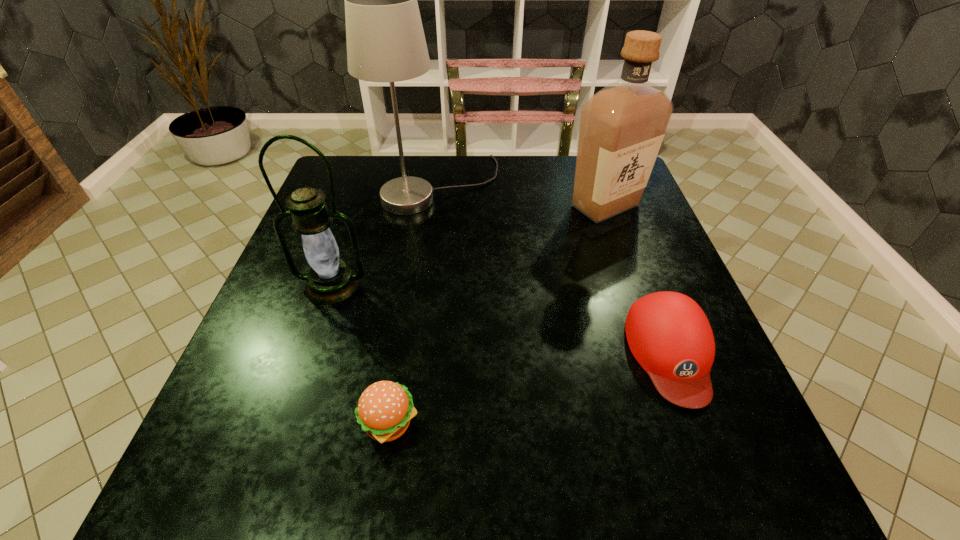
I want to click on vacant area between the table lamp and the baseball cap, so click(555, 269).

Find the location of a particular element. Image resolution: width=960 pixels, height=540 pixels. vacant point located between the liquor and the baseball cap is located at coordinates (637, 279).

Locate an element on the screen. vacant area that lies between the baseball cap and the hamburger is located at coordinates (530, 389).

Where is `empty space that is in between the liquor and the table lamp`? This screenshot has height=540, width=960. empty space that is in between the liquor and the table lamp is located at coordinates (522, 195).

Locate an element on the screen. Image resolution: width=960 pixels, height=540 pixels. vacant area between the third tallest object and the table lamp is located at coordinates (386, 235).

Image resolution: width=960 pixels, height=540 pixels. In order to click on vacant region between the hamburger and the liquor in this screenshot , I will do `click(497, 315)`.

Locate an element on the screen. the third closest object to the table lamp is located at coordinates (669, 335).

Identify which object is the second nearest to the hamburger. Please provide its 2D coordinates. Your answer should be formatted as a tuple, i.e. [(x, y)], where the tuple contains the x and y coordinates of a point satisfying the conditions above.

[(669, 335)]

At what (x,y) coordinates should I click in order to perform the action: click on free point that satisfies the following two spatial constraints: 1. on the side where the third tallest object emits light; 2. on the left side of the hamburger. Please return your answer as a coordinate pair (x, y). Looking at the image, I should click on (285, 424).